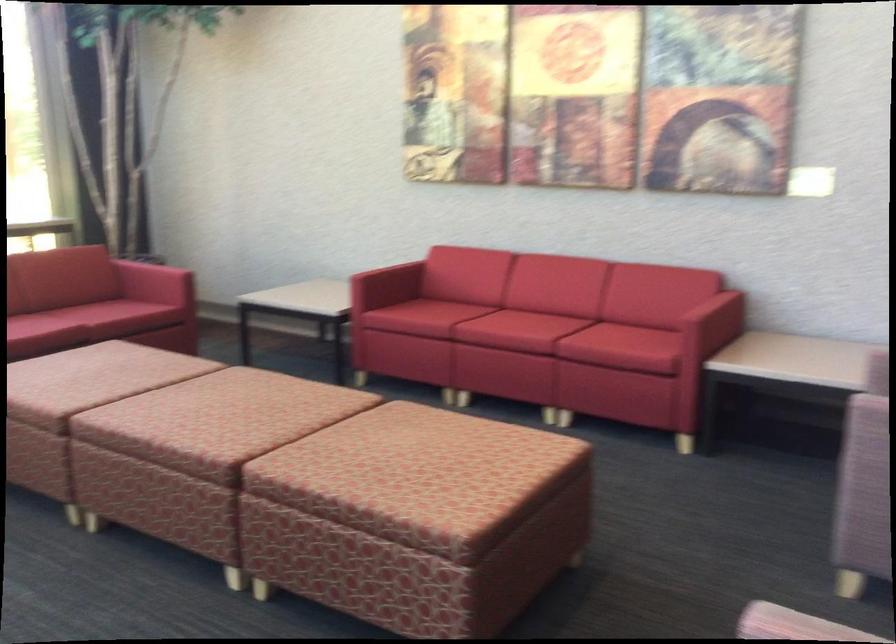
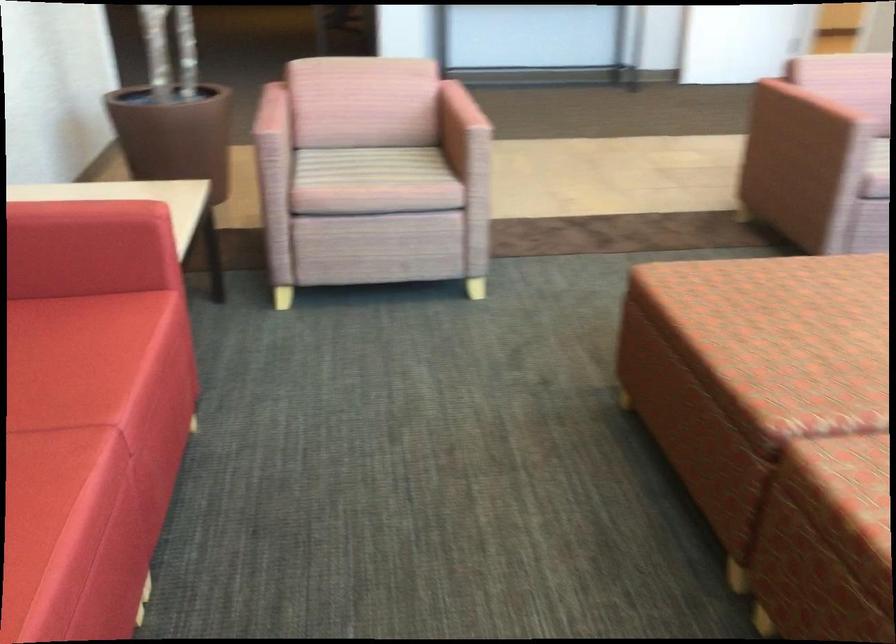
In the second image, find the point that corresponds to pixel 617 330 in the first image.

(69, 360)